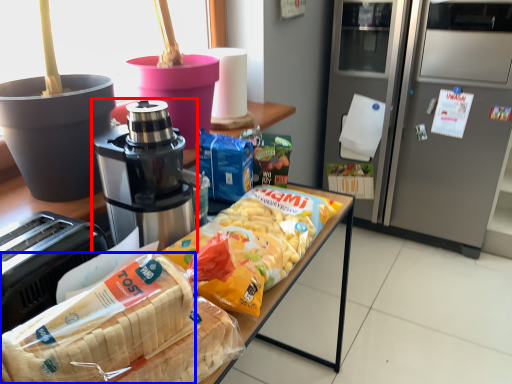
Question: Which of the following is the closest to the observer, coffee maker (highlighted by a red box) or cereal (highlighted by a blue box)?

Choices:
 (A) coffee maker
 (B) cereal

Answer: (B)